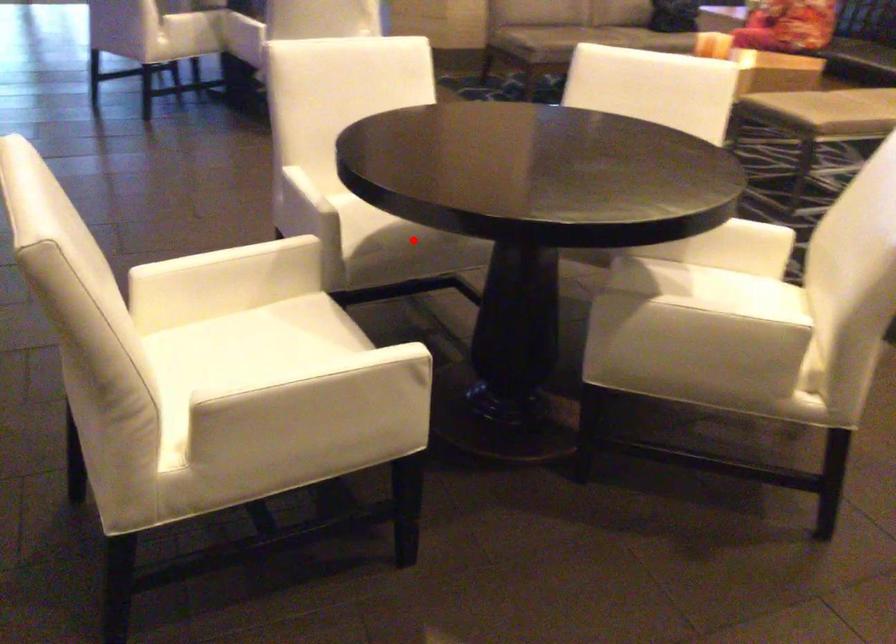
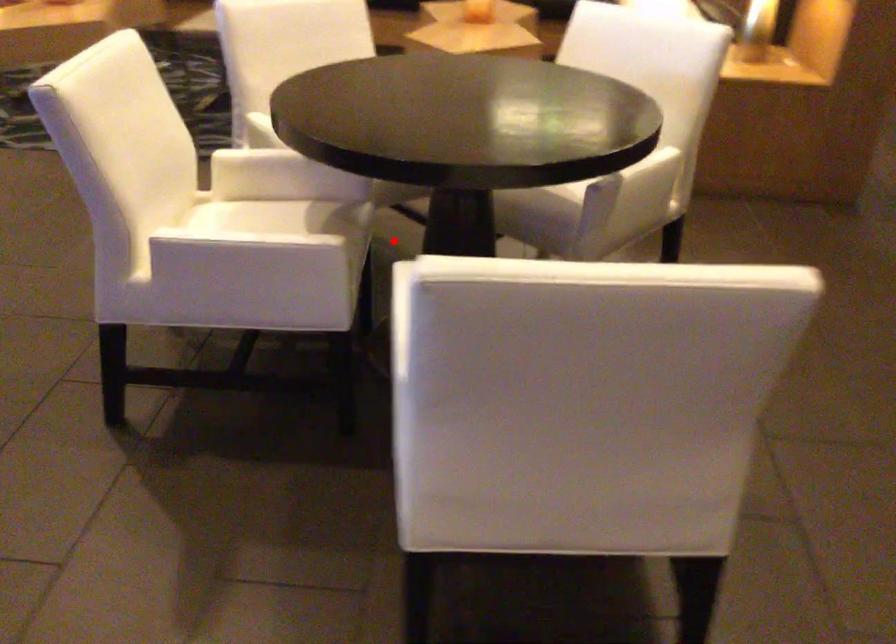
Looking at this image, I am providing you with two images of the same scene from different viewpoints. A red point is marked on the first image and another point is marked on the second image. Is the red point in image1 aligned with the point shown in image2?

No